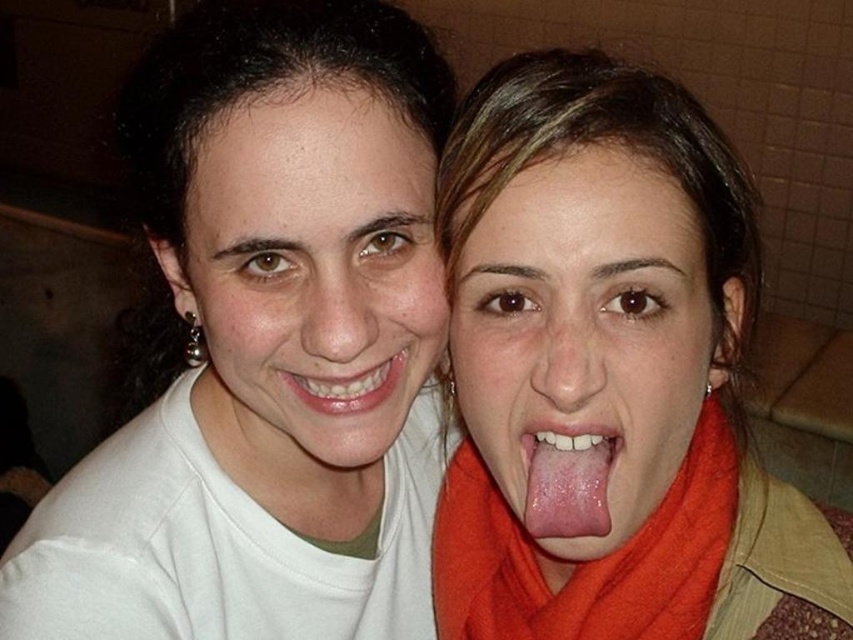
The image size is (853, 640). Describe the element at coordinates (265, 344) in the screenshot. I see `white matte shirt at upper left` at that location.

Does point (216, 196) lie in front of point (344, 374)?

Yes, it is.

This screenshot has height=640, width=853. Identify the location of white matte shirt at upper left. pos(265,344).

Which is more to the left, white matte shirt at upper left or matte white face at center?

Positioned to the left is white matte shirt at upper left.

Does white matte shirt at upper left have a greater height compared to matte white face at center?

Yes, white matte shirt at upper left is taller than matte white face at center.

Find the location of a particular element. This screenshot has width=853, height=640. white matte shirt at upper left is located at coordinates (265, 344).

Is matte white face at center wider than pink glossy tongue at center?

Yes, matte white face at center is wider than pink glossy tongue at center.

The image size is (853, 640). Identify the location of matte white face at center. (309, 276).

Between point (360, 449) and point (613, 440), which one is positioned behind?

The point (360, 449) is behind.

Where is `matte white face at center`? This screenshot has width=853, height=640. matte white face at center is located at coordinates (309, 276).